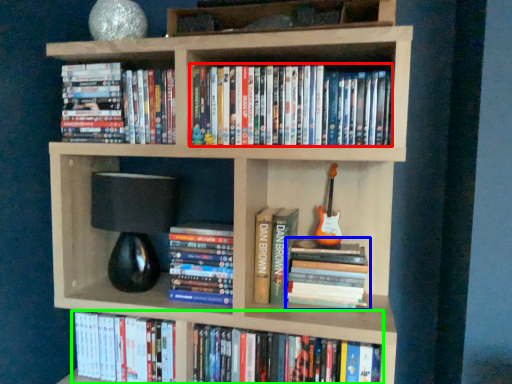
Question: Considering the real-world distances, which object is farthest from book (highlighted by a red box)? book (highlighted by a blue box) or book (highlighted by a green box)?

Choices:
 (A) book
 (B) book

Answer: (B)